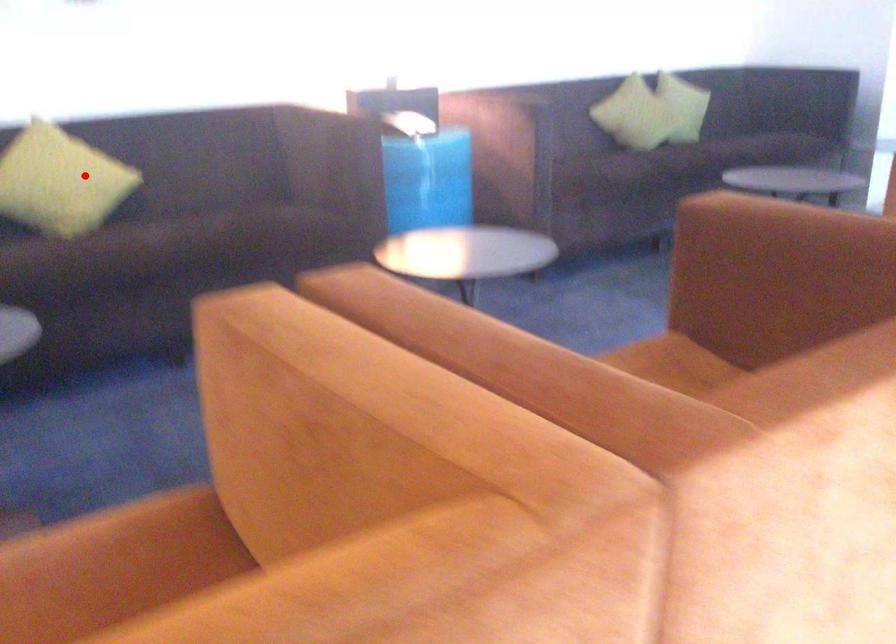
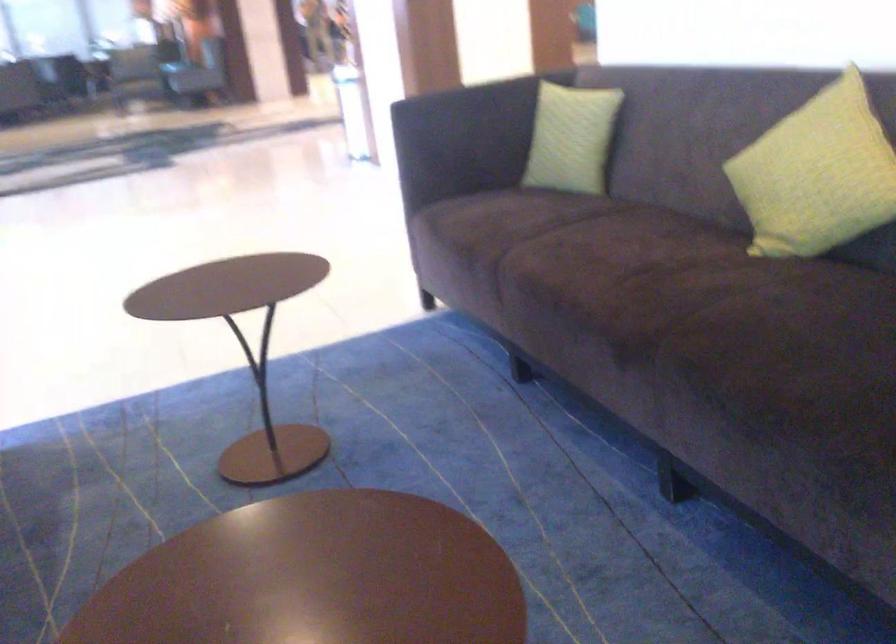
Question: I am providing you with two images of the same scene from different viewpoints. A red point is shown in image1. For the corresponding object point in image2, is it positioned nearer or farther from the camera?

Choices:
 (A) Nearer
 (B) Farther

Answer: (A)